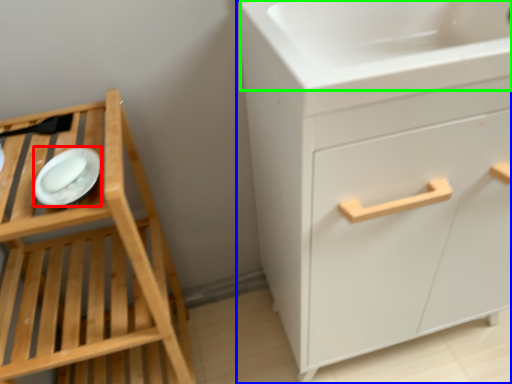
Question: Which object is the farthest from platter (highlighted by a red box)? Choose among these: chest of drawers (highlighted by a blue box) or sink (highlighted by a green box).

Choices:
 (A) chest of drawers
 (B) sink

Answer: (A)